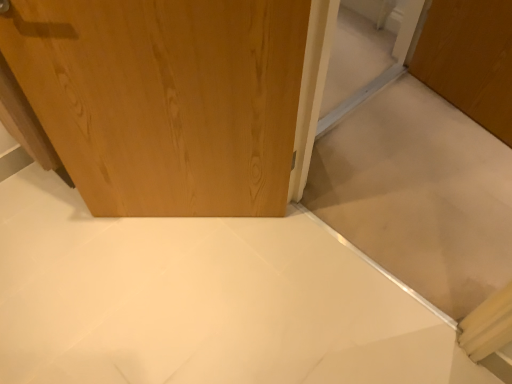
I want to click on free spot below wooden door at upper left (from a real-world perspective), so click(181, 221).